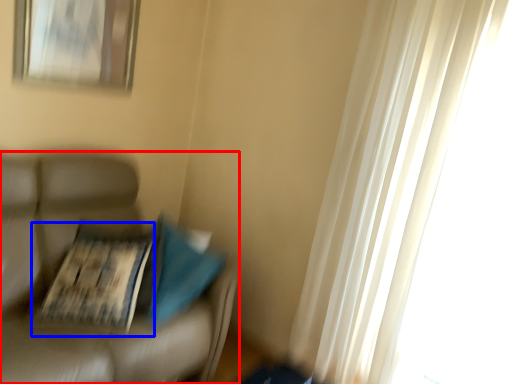
Question: Which point is closer to the camera, furniture (highlighted by a red box) or magazine (highlighted by a blue box)?

Choices:
 (A) furniture
 (B) magazine

Answer: (A)